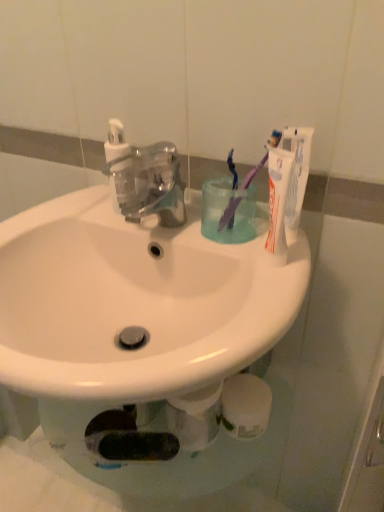
You are a GUI agent. You are given a task and a screenshot of the screen. Output one action in this format:
    pyautogui.click(x=<x>, y=<y>)
    Task: Click on the free space to the right of transparent plastic faucet at center
    The height and width of the screenshot is (512, 384).
    Given the screenshot: What is the action you would take?
    pyautogui.click(x=223, y=241)